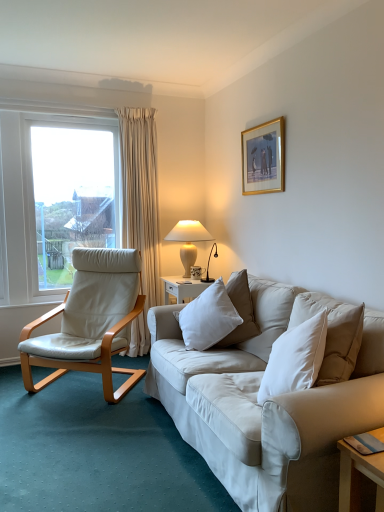
Locate an element on the screen. free space in front of white leather chair at left is located at coordinates (81, 432).